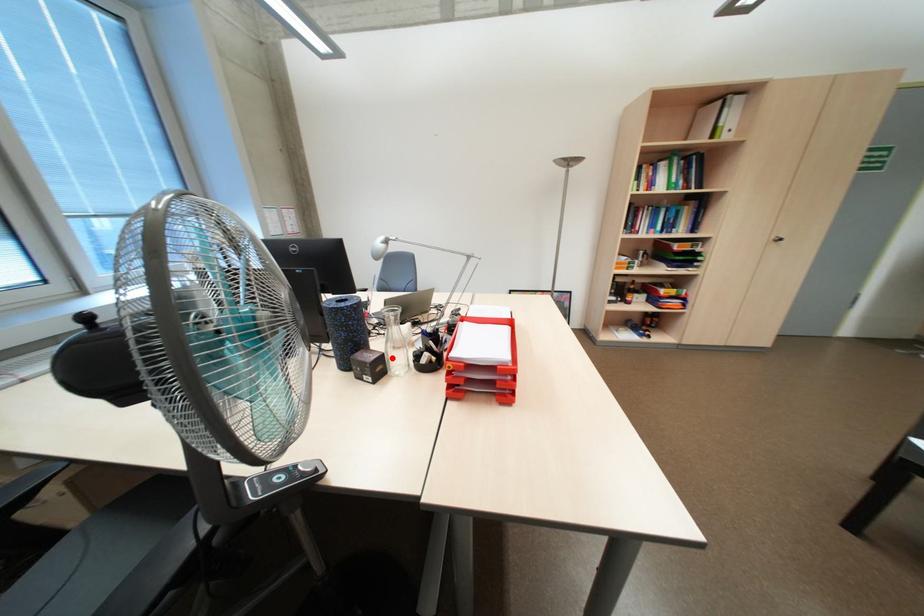
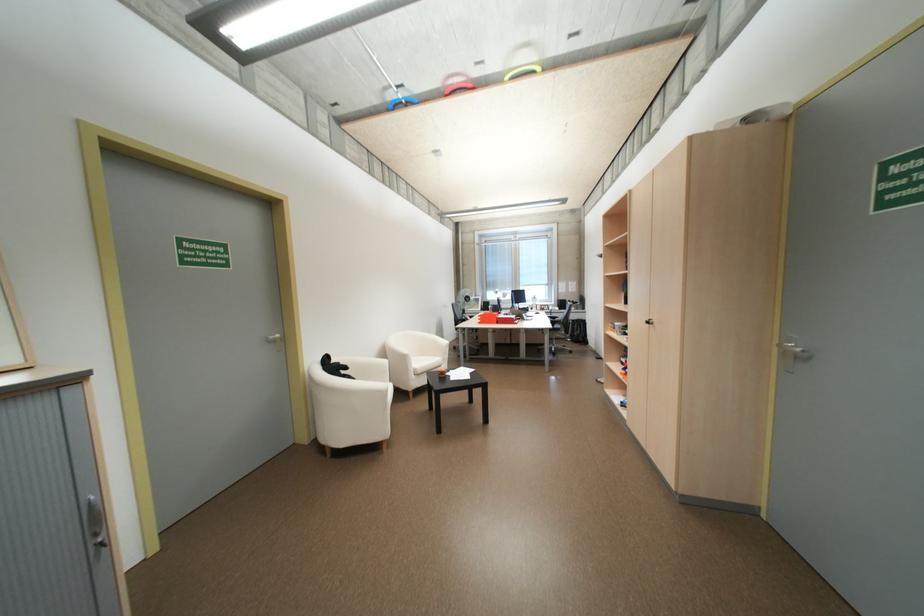
Question: I am providing you with two images of the same scene from different viewpoints. A red point is marked on the first image. Is the red point's position out of view in image 2?

Choices:
 (A) Yes
 (B) No

Answer: (A)